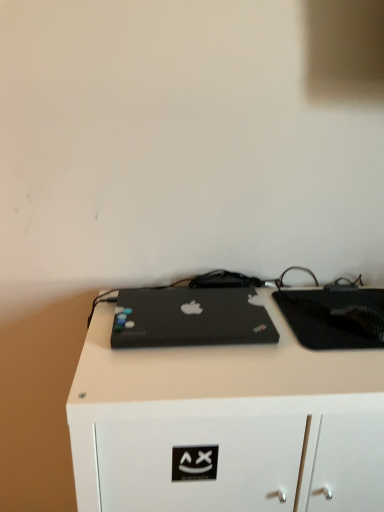
Image resolution: width=384 pixels, height=512 pixels. I want to click on free space in front of black matte laptop at center, so click(x=189, y=376).